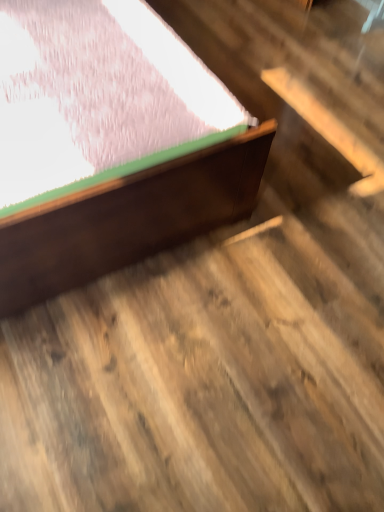
The image size is (384, 512). I want to click on wooden bed at upper left, so click(x=128, y=218).

This screenshot has height=512, width=384. Describe the element at coordinates (128, 218) in the screenshot. I see `wooden bed at upper left` at that location.

Measure the distance between point (75, 217) and camera.

Point (75, 217) is 3.92 feet from camera.

Where is `wooden bed at upper left`? wooden bed at upper left is located at coordinates (128, 218).